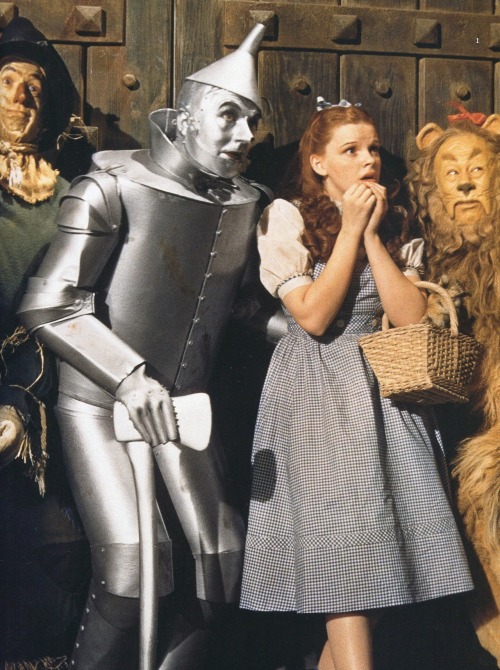
Locate an element on the screen. basket is located at coordinates (410, 346).